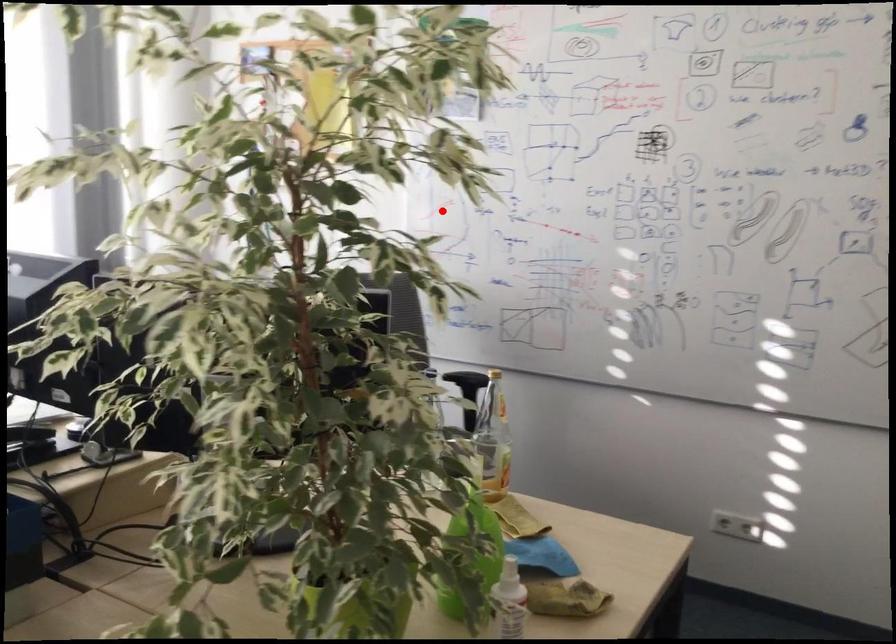
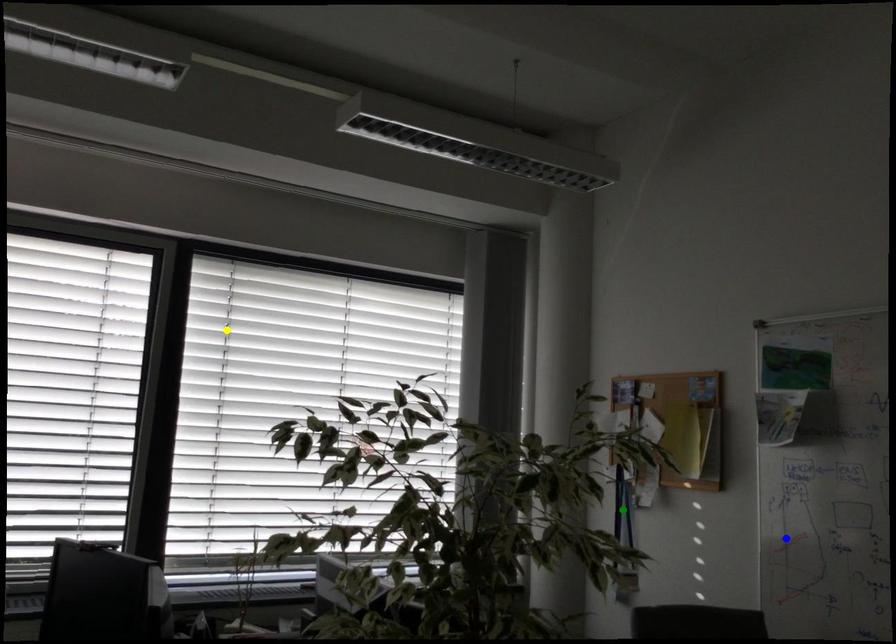
Question: I am providing you with two images of the same scene from different viewpoints. A red point is marked on the first image. You are given multiple points on the second image. In image 2, which mark is for the same physical point as the one in image 1?

Choices:
 (A) yellow point
 (B) blue point
 (C) green point

Answer: (B)